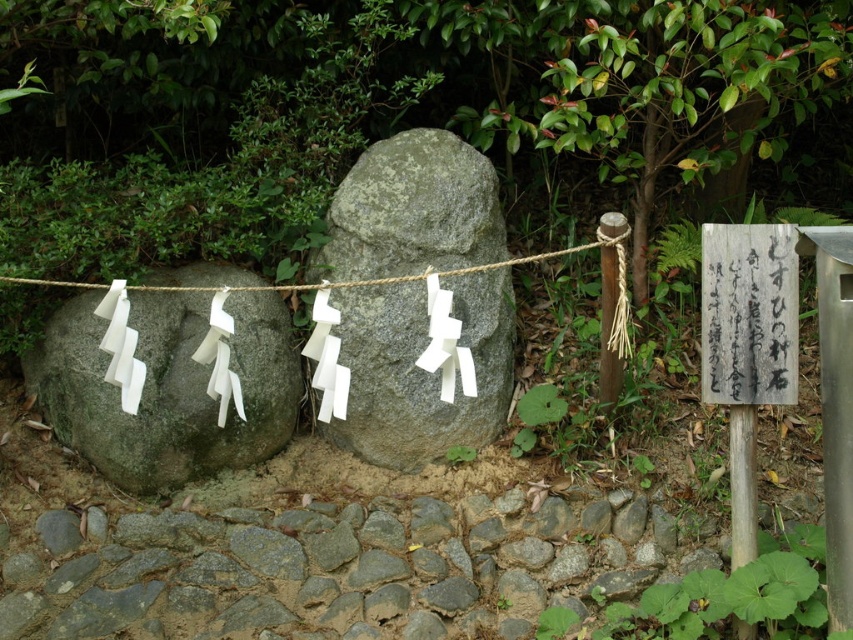
You are a visitor at this shrine and want to place a small offering between the gray rough stone at left and the wooden signpost at center right. Based on their positions, where should you place it?

Since the gray rough stone at left is to the left of the wooden signpost at center right, you should place the offering between them, ensuring it is positioned to the right of the gray rough stone at left and to the left of the wooden signpost at center right.

You are a visitor at a shrine and want to place a small offering between the gray rough stone at center and the gray rough stone at left. Given that your offering is 30 cm wide, will it fit between them?

The gray rough stone at center is larger in size than the gray rough stone at left, but the exact distance between them isn t specified. Without knowing the space between the stones, it s impossible to determine if the offering will fit.